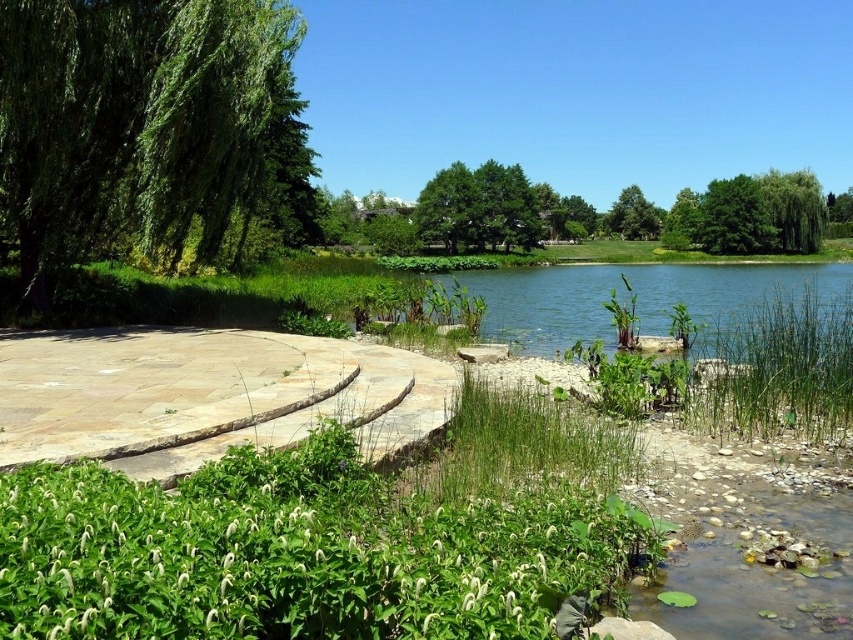
You are a painter setting up an easel to capture this natural scene. You want to ensure your painting accurately represents the relative widths of the green leafy tree at left and the clear blue water at center. Based on the scene, which object is narrower?

The green leafy tree at left is narrower than the clear blue water at center.

You are standing at the center of the curved stone pathway and want to reach the water edge. Which direction should you walk to avoid the green leafy tree at left?

The green leafy tree at left is located at point (135,120), so you should walk towards the right side of the pathway to avoid it.

You are standing on the curved stone pathway and looking towards the water. Which green leafy tree is closer to your left side? The green leafy tree at center or the green leafy tree at upper center?

The green leafy tree at center is to the left of green leafy tree at upper center, so when looking towards the water, the green leafy tree at center is closer to your left side.